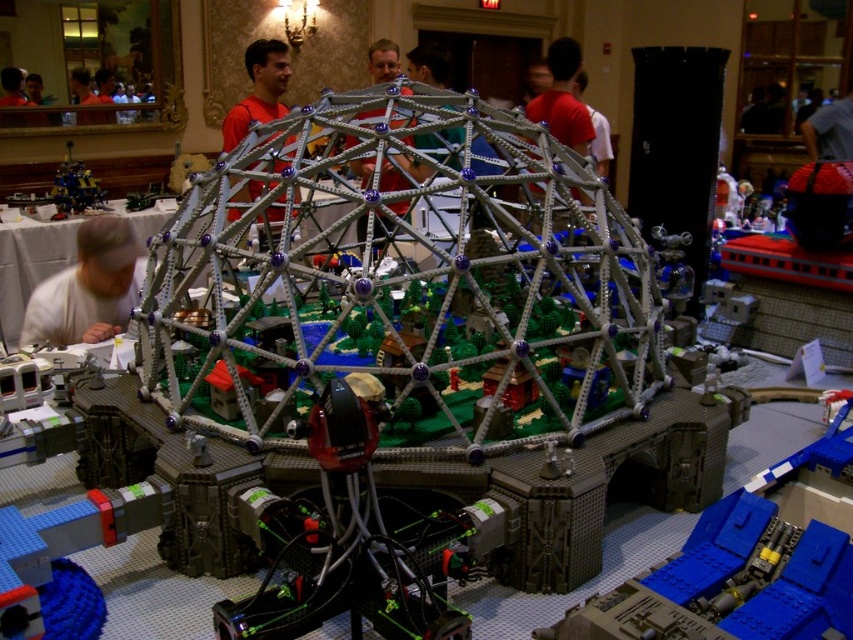
You are standing in front of the Lego construction and want to pick up the white matte shirt at lower left and the metallic blue robot at left. Which object should you reach for first to grab both without moving your position?

You should reach for the white matte shirt at lower left first because it is closer to you than the metallic blue robot at left, allowing you to grab both objects without moving your position.

In the scene shown: You are organizing a charity event and need to determine clothing sizes for participants. You see a white matte shirt at lower left and an orange shirt at center in the image. Which shirt should you choose if you need a larger size for a participant?

The orange shirt at center is larger than the white matte shirt at lower left, so you should choose the orange shirt at center for the participant needing a larger size.